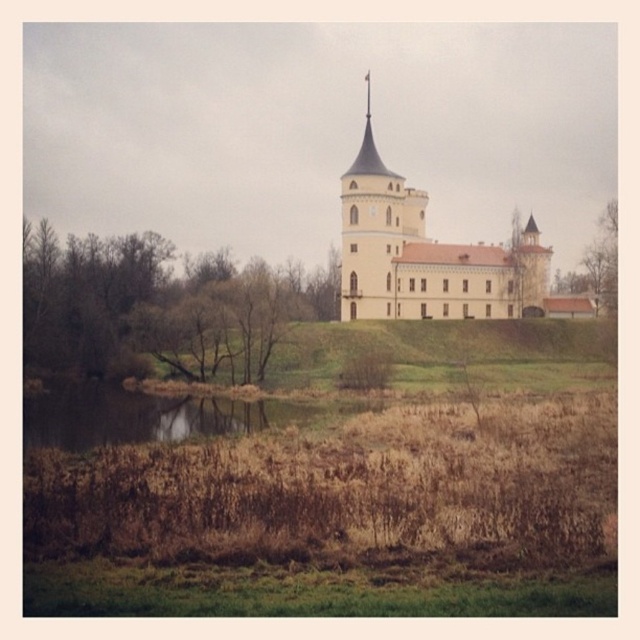
Which is in front, point (410, 264) or point (592, 257)?

Point (410, 264) is more forward.

Which is below, white smooth castle at center or brown textured tree at right?

brown textured tree at right is below.

Is point (362, 257) positioned after point (568, 282)?

No, (362, 257) is closer to viewer.

Identify the location of white smooth castle at center. (422, 253).

Who is positioned more to the left, brown grassy water at lower left or brown textured tree at right?

Positioned to the left is brown grassy water at lower left.

Looking at this image, how far apart are brown grassy water at lower left and brown textured tree at right?

brown grassy water at lower left and brown textured tree at right are 173.64 feet apart from each other.

At what (x,y) coordinates should I click in order to perform the action: click on brown grassy water at lower left. Please return your answer as a coordinate pair (x, y). The height and width of the screenshot is (640, 640). Looking at the image, I should click on (141, 416).

Is white smooth castle at center behind brown grassy water at lower left?

Yes, white smooth castle at center is further from the viewer.

Between point (413, 289) and point (141, 403), which one is positioned in front?

Point (141, 403) is more forward.

The width and height of the screenshot is (640, 640). Find the location of `white smooth castle at center`. white smooth castle at center is located at coordinates (422, 253).